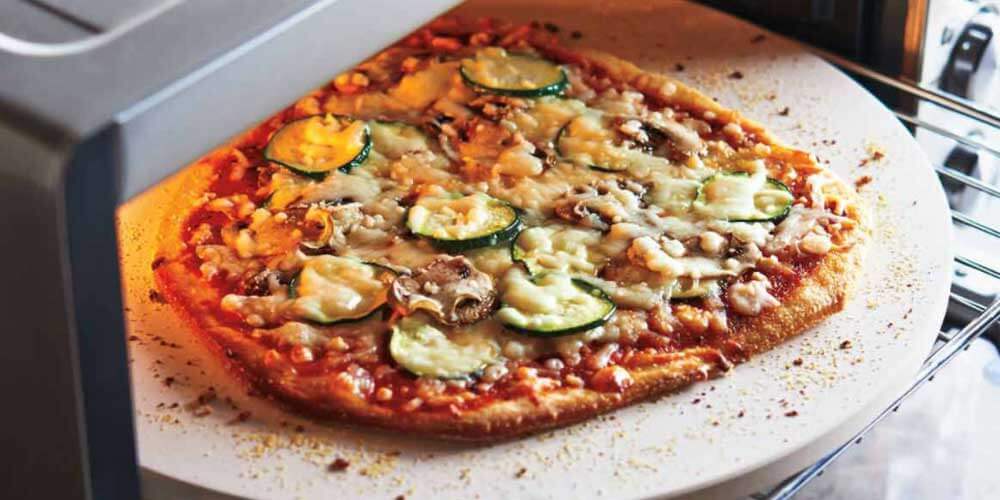
At what (x,y) coordinates should I click in order to perform the action: click on background floor. Please return your answer as a coordinate pair (x, y). The height and width of the screenshot is (500, 1000). Looking at the image, I should click on (967, 445).